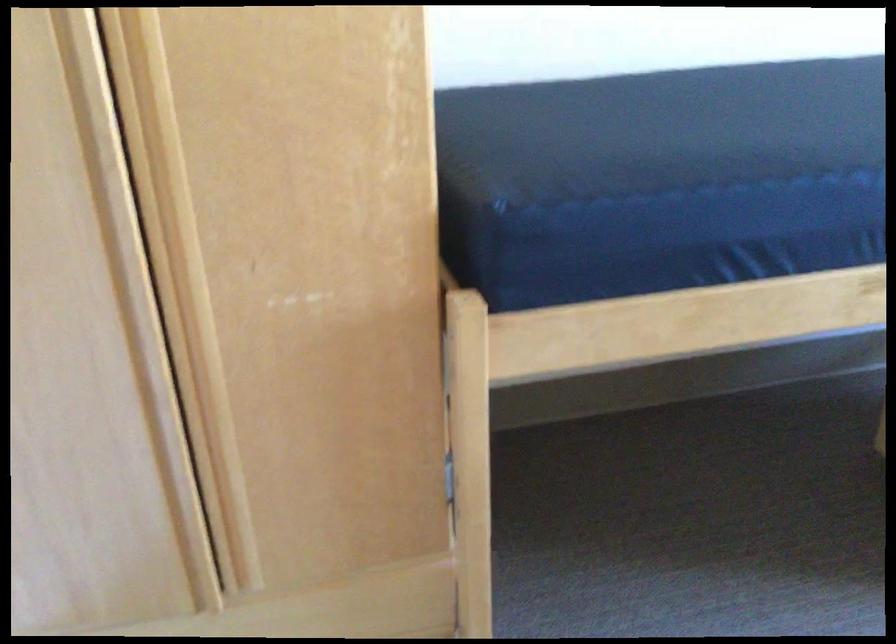
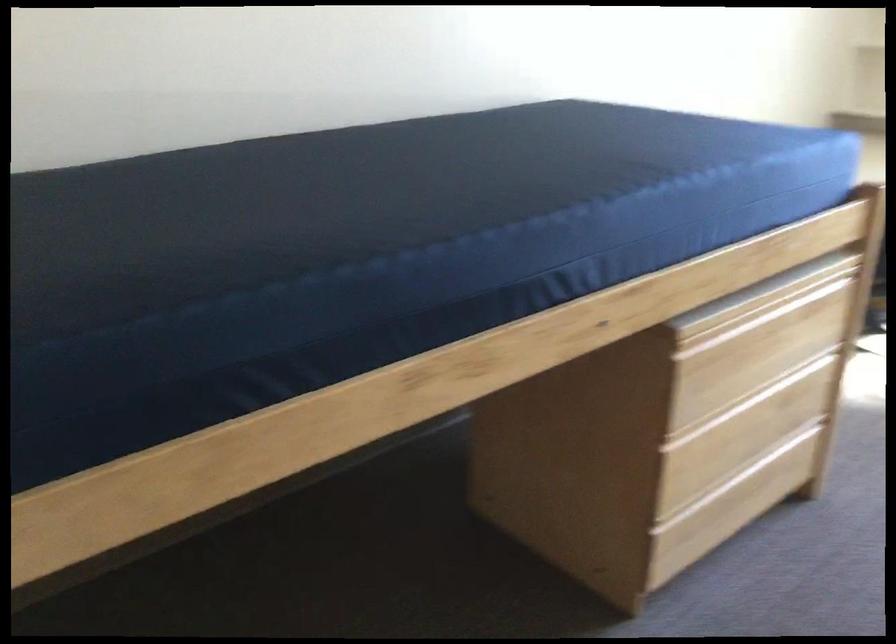
Consider the image. What movement of the cameraman would produce the second image?

The cameraman walked toward right, forward.